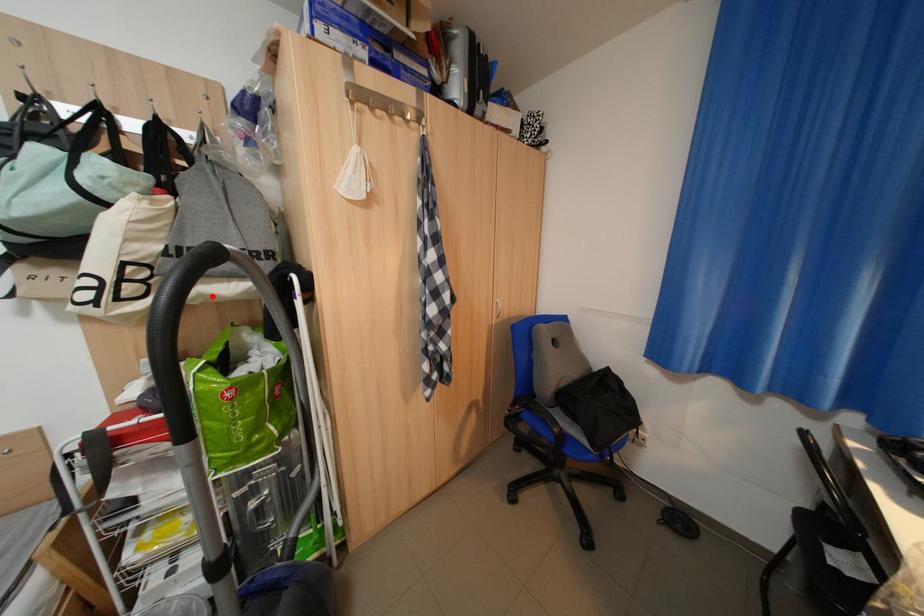
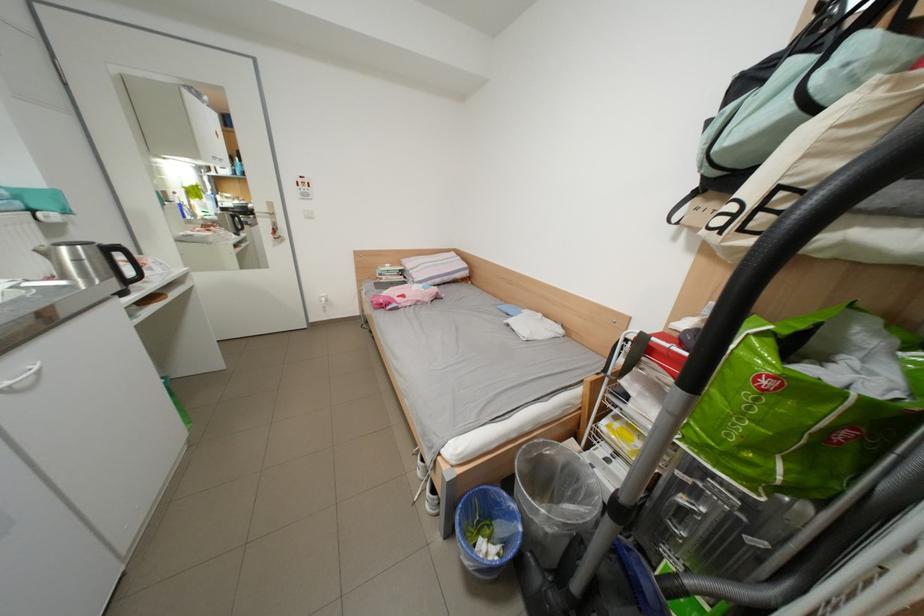
Find the pixel in the second image that matches the highlighted location in the first image.

(856, 245)